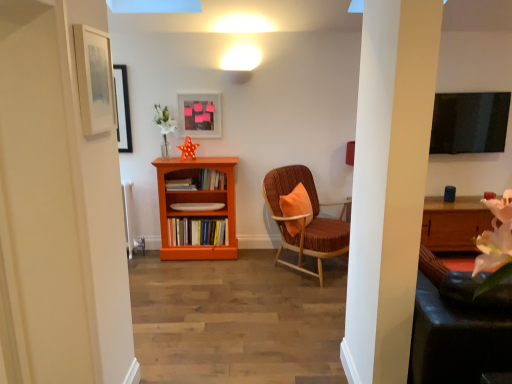
This screenshot has width=512, height=384. Identify the location of vacant area that lies in front of velvet brown chair with orange cushion at center. (292, 305).